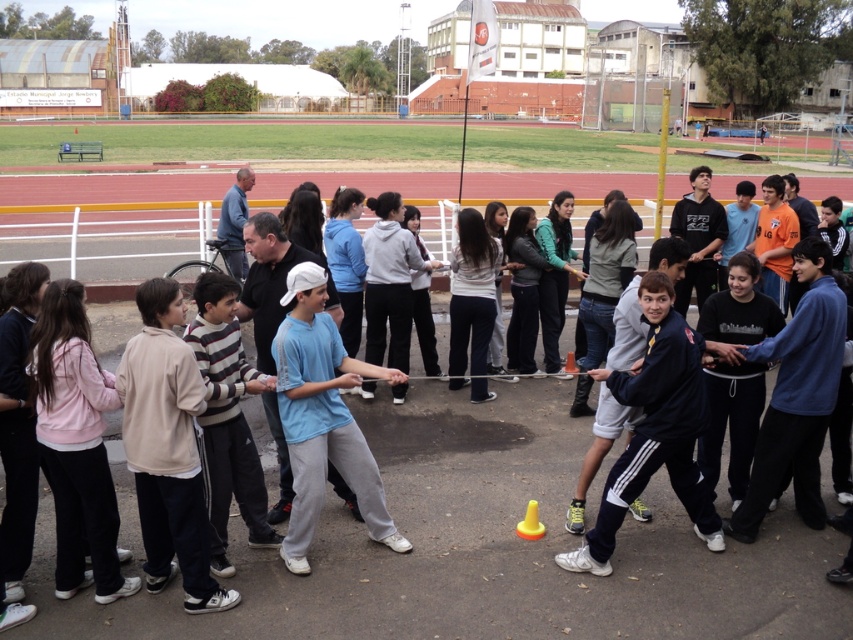
Question: Does light blue t-shirt at center appear on the left side of navy blue sweatshirt at center?

Choices:
 (A) yes
 (B) no

Answer: (A)

Question: Observing the image, what is the correct spatial positioning of light blue t-shirt at center in reference to navy blue sweatshirt at center?

Choices:
 (A) below
 (B) above

Answer: (B)

Question: Which point appears farthest from the camera in this image?

Choices:
 (A) (579, 548)
 (B) (281, 420)

Answer: (A)

Question: Can you confirm if light blue t-shirt at center is positioned below navy blue sweatshirt at center?

Choices:
 (A) no
 (B) yes

Answer: (A)